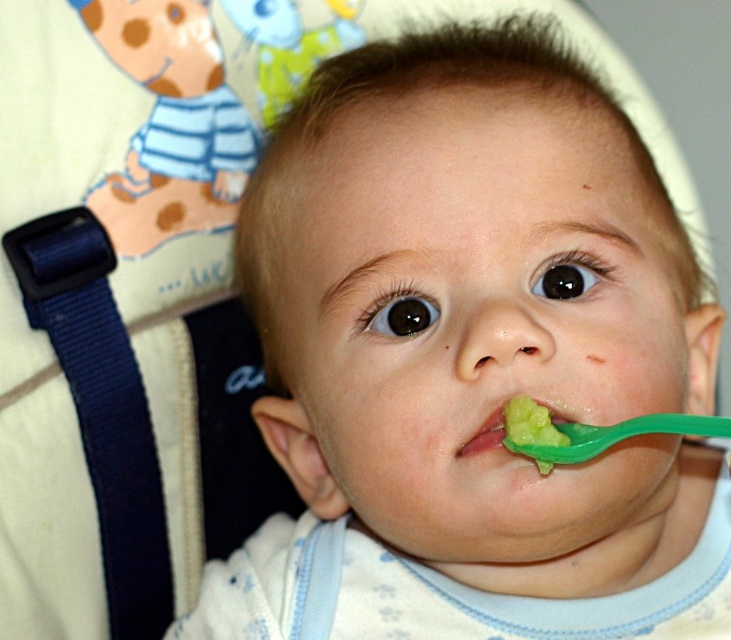
What do you see at coordinates (613, 435) in the screenshot? The image size is (731, 640). I see `green plastic spoon at mouth` at bounding box center [613, 435].

Does green plastic spoon at mouth have a greater height compared to green plastic spoon at lower center?

In fact, green plastic spoon at mouth may be shorter than green plastic spoon at lower center.

Identify the location of green plastic spoon at mouth. (613, 435).

The width and height of the screenshot is (731, 640). I want to click on green plastic spoon at mouth, so click(613, 435).